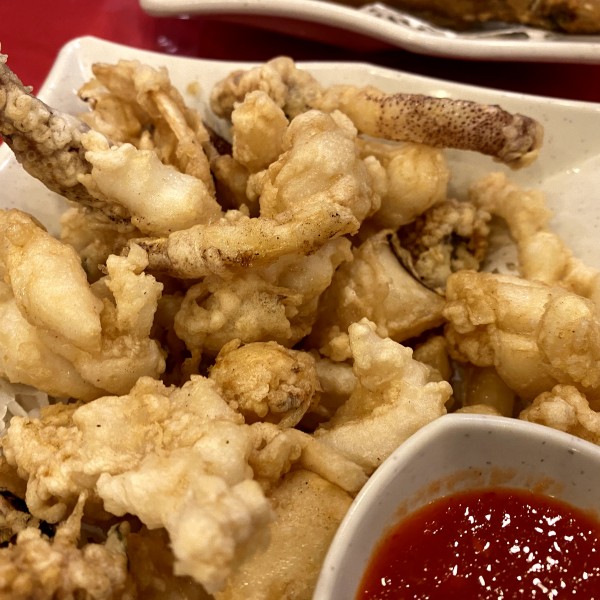
Locate an element on the screen. bowl is located at coordinates (474, 434).